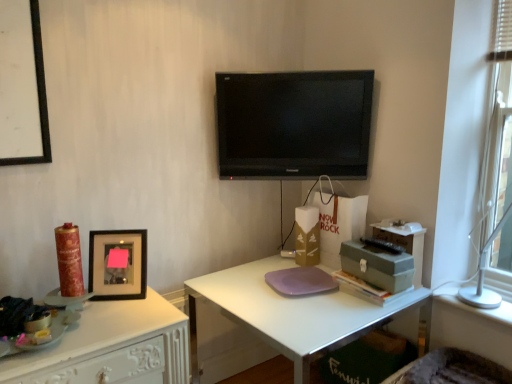
Question: Can you confirm if white glossy desk at left, placed as the 2th desk when sorted from right to left, is taller than black glossy flat-screen tv at center?

Choices:
 (A) no
 (B) yes

Answer: (B)

Question: Does white glossy desk at left, the first desk in the left-to-right sequence, lie in front of black glossy flat-screen tv at center?

Choices:
 (A) yes
 (B) no

Answer: (A)

Question: Can you confirm if white glossy desk at left, placed as the 2th desk when sorted from right to left, is wider than black glossy flat-screen tv at center?

Choices:
 (A) no
 (B) yes

Answer: (B)

Question: From a real-world perspective, is white glossy desk at left, placed as the 2th desk when sorted from right to left, under black glossy flat-screen tv at center?

Choices:
 (A) no
 (B) yes

Answer: (B)

Question: Is white glossy desk at left, the first desk in the left-to-right sequence, far from black glossy flat-screen tv at center?

Choices:
 (A) yes
 (B) no

Answer: (A)

Question: Is shiny gold candle at left taller or shorter than black glossy flat-screen tv at center?

Choices:
 (A) tall
 (B) short

Answer: (B)

Question: Is shiny gold candle at left situated inside black glossy flat-screen tv at center or outside?

Choices:
 (A) inside
 (B) outside

Answer: (B)

Question: Visually, is shiny gold candle at left positioned to the left or to the right of black glossy flat-screen tv at center?

Choices:
 (A) left
 (B) right

Answer: (A)

Question: Considering the positions of point (79, 253) and point (351, 150), is point (79, 253) closer or farther from the camera than point (351, 150)?

Choices:
 (A) closer
 (B) farther

Answer: (A)

Question: Looking at the image, does black glossy flat-screen tv at center seem bigger or smaller compared to shiny gold candle at left?

Choices:
 (A) big
 (B) small

Answer: (A)

Question: From a real-world perspective, is black glossy flat-screen tv at center physically located above or below shiny gold candle at left?

Choices:
 (A) above
 (B) below

Answer: (A)

Question: Is black glossy flat-screen tv at center wider or thinner than shiny gold candle at left?

Choices:
 (A) thin
 (B) wide

Answer: (A)

Question: In the image, is black glossy flat-screen tv at center on the left side or the right side of shiny gold candle at left?

Choices:
 (A) right
 (B) left

Answer: (A)

Question: From the image's perspective, is fuzzy fabric swivel chair at lower right located above or below matte green box at right, the second box positioned from the right?

Choices:
 (A) below
 (B) above

Answer: (A)

Question: From a real-world perspective, relative to matte green box at right, arranged as the first box when viewed from the left, is fuzzy fabric swivel chair at lower right vertically above or below?

Choices:
 (A) below
 (B) above

Answer: (A)